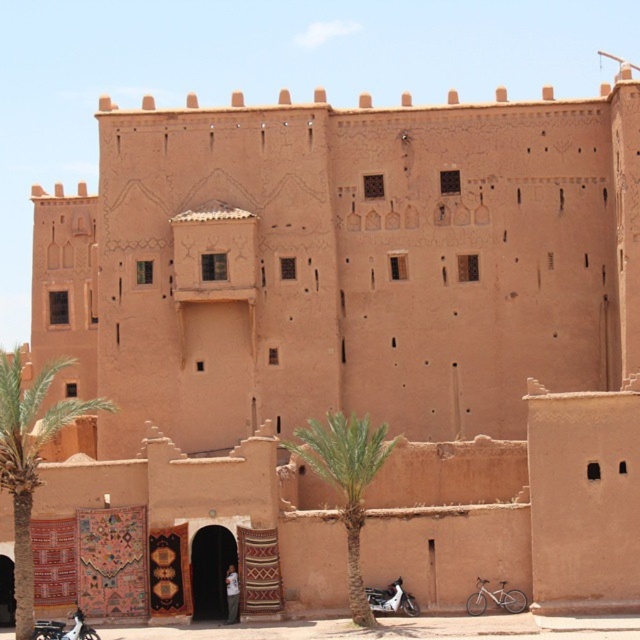
Can you confirm if green leafy palm tree at left is positioned below white matte motorcycle at lower center?

Incorrect, green leafy palm tree at left is not positioned below white matte motorcycle at lower center.

Which of these two, green leafy palm tree at left or white matte motorcycle at lower center, stands shorter?

white matte motorcycle at lower center is shorter.

Between point (1, 358) and point (369, 602), which one is positioned in front?

Point (1, 358) is more forward.

This screenshot has width=640, height=640. Identify the location of green leafy palm tree at left. tap(29, 458).

Between point (17, 358) and point (333, 426), which one is positioned in front?

Point (17, 358) is in front.

Is green leafy palm tree at left above green leafy palm tree at center?

Yes.

The image size is (640, 640). Describe the element at coordinates (29, 458) in the screenshot. I see `green leafy palm tree at left` at that location.

At what (x,y) coordinates should I click in order to perform the action: click on green leafy palm tree at left. Please return your answer as a coordinate pair (x, y). This screenshot has width=640, height=640. Looking at the image, I should click on (29, 458).

Who is lower down, green leafy palm tree at left or white fabric motorcyclist at center?

white fabric motorcyclist at center is below.

Does point (17, 349) come in front of point (236, 608)?

No, it is not.

The width and height of the screenshot is (640, 640). I want to click on green leafy palm tree at left, so click(x=29, y=458).